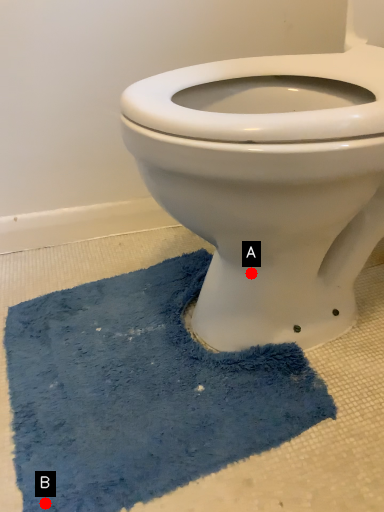
Question: Two points are circled on the image, labeled by A and B beside each circle. Among these points, which one is farthest from the camera?

Choices:
 (A) A is further
 (B) B is further

Answer: (A)